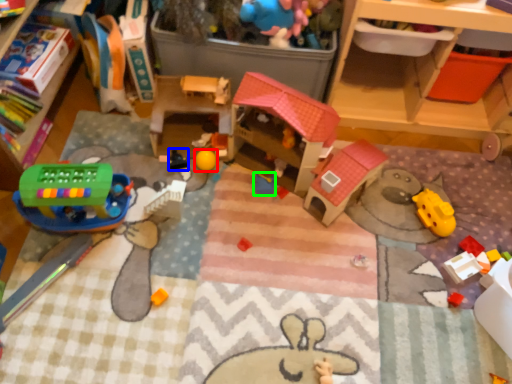
Question: Considering the real-world distances, which object is closest to toy (highlighted by a red box)? toy (highlighted by a blue box) or toy (highlighted by a green box).

Choices:
 (A) toy
 (B) toy

Answer: (A)